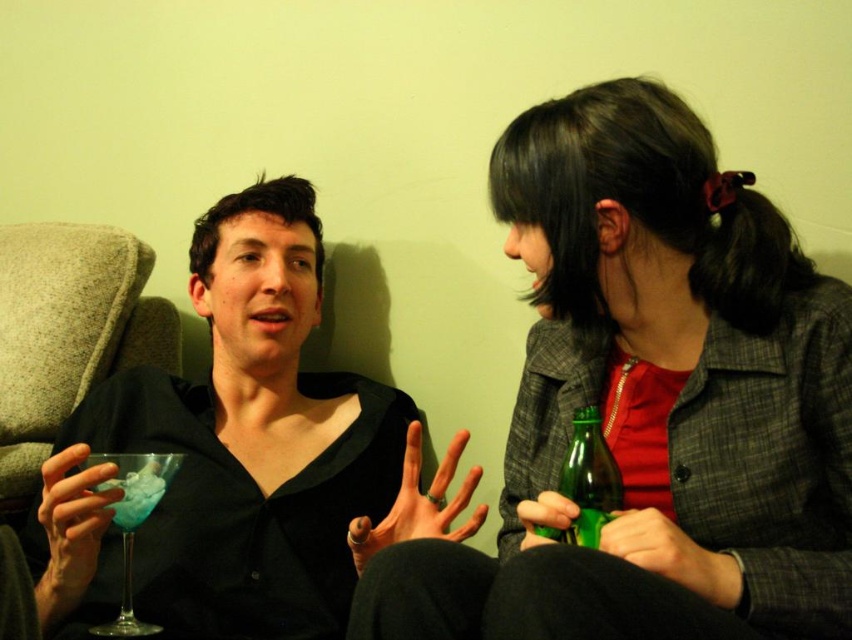
You are a photographer standing 1 meter away from the matte black shirt at left. Can you take a clear photo of it without moving closer?

The matte black shirt at left is 82.07 centimeters away from the camera, which is within your current 1 meter distance. Therefore, you can take a clear photo of it without moving closer.

You are a photographer setting up a shoot and need to arrange two props based on their positions in the image. The matte black shirt at left and the green glass bottle at right are part of the setup. According to the scene, which prop should be placed to the left of the other?

The matte black shirt at left should be placed to the left of the green glass bottle at right because the description states that the matte black shirt at left is positioned on the left side of the green glass bottle at right.

You are a tailor who needs to determine if the plaid fabric jacket at center can be stored in a box designed for items smaller than the translucent glass at left. Based on the scene, can the jacket fit into the box?

The plaid fabric jacket at center is larger in size than the translucent glass at left, so it cannot fit into a box designed for items smaller than the translucent glass at left.